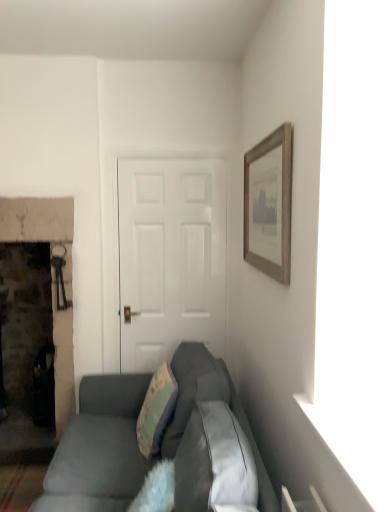
Question: Is black plastic trash can at left oriented towards wooden framed print at upper right?

Choices:
 (A) no
 (B) yes

Answer: (A)

Question: Is black plastic trash can at left turned away from wooden framed print at upper right?

Choices:
 (A) yes
 (B) no

Answer: (B)

Question: Considering the relative sizes of black plastic trash can at left and wooden framed print at upper right in the image provided, is black plastic trash can at left bigger than wooden framed print at upper right?

Choices:
 (A) no
 (B) yes

Answer: (A)

Question: Considering the relative sizes of black plastic trash can at left and wooden framed print at upper right in the image provided, is black plastic trash can at left taller than wooden framed print at upper right?

Choices:
 (A) no
 (B) yes

Answer: (A)

Question: Would you consider black plastic trash can at left to be distant from wooden framed print at upper right?

Choices:
 (A) no
 (B) yes

Answer: (B)

Question: From a real-world perspective, is suede gray couch at lower center above or below teal fabric pillow at center?

Choices:
 (A) above
 (B) below

Answer: (B)

Question: Considering the positions of suede gray couch at lower center and teal fabric pillow at center in the image, is suede gray couch at lower center bigger or smaller than teal fabric pillow at center?

Choices:
 (A) small
 (B) big

Answer: (B)

Question: Based on their positions, is suede gray couch at lower center located to the left or right of teal fabric pillow at center?

Choices:
 (A) left
 (B) right

Answer: (A)

Question: Considering the positions of point (127, 398) and point (157, 409), is point (127, 398) closer or farther from the camera than point (157, 409)?

Choices:
 (A) closer
 (B) farther

Answer: (B)

Question: Based on their positions, is wooden framed print at upper right located to the left or right of black plastic trash can at left?

Choices:
 (A) left
 (B) right

Answer: (B)

Question: In the image, is wooden framed print at upper right positioned in front of or behind black plastic trash can at left?

Choices:
 (A) front
 (B) behind

Answer: (A)

Question: In terms of size, does wooden framed print at upper right appear bigger or smaller than black plastic trash can at left?

Choices:
 (A) big
 (B) small

Answer: (A)

Question: Does point (281, 208) appear closer or farther from the camera than point (48, 352)?

Choices:
 (A) closer
 (B) farther

Answer: (A)

Question: Is teal fabric pillow at center taller or shorter than black plastic trash can at left?

Choices:
 (A) short
 (B) tall

Answer: (A)

Question: From the image's perspective, is teal fabric pillow at center located above or below black plastic trash can at left?

Choices:
 (A) below
 (B) above

Answer: (B)